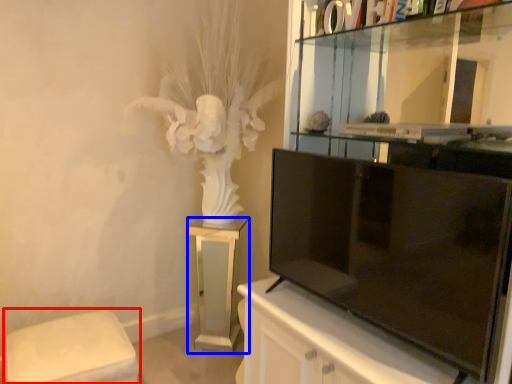
Question: Which object appears closest to the camera in this image, furniture (highlighted by a red box) or furniture (highlighted by a blue box)?

Choices:
 (A) furniture
 (B) furniture

Answer: (A)